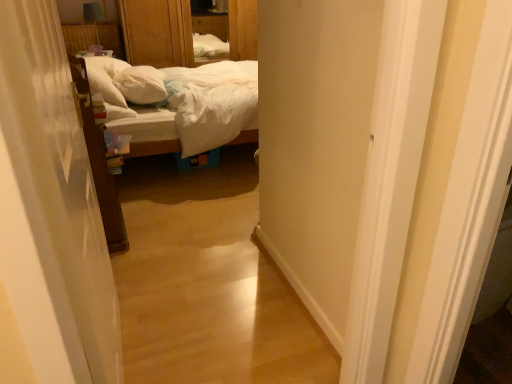
Question: Does wooden dresser at upper center lie behind white soft pillow at center?

Choices:
 (A) yes
 (B) no

Answer: (A)

Question: Is wooden dresser at upper center aimed at white soft pillow at center?

Choices:
 (A) yes
 (B) no

Answer: (A)

Question: Can you confirm if wooden dresser at upper center is bigger than white soft pillow at center?

Choices:
 (A) no
 (B) yes

Answer: (B)

Question: Does wooden dresser at upper center have a lesser height compared to white soft pillow at center?

Choices:
 (A) no
 (B) yes

Answer: (A)

Question: Considering the relative sizes of wooden dresser at upper center and white soft pillow at center in the image provided, is wooden dresser at upper center thinner than white soft pillow at center?

Choices:
 (A) no
 (B) yes

Answer: (A)

Question: Considering the relative sizes of wooden dresser at upper center and white soft pillow at center in the image provided, is wooden dresser at upper center taller than white soft pillow at center?

Choices:
 (A) no
 (B) yes

Answer: (B)

Question: Is white soft pillow at center located outside wooden dresser at upper center?

Choices:
 (A) yes
 (B) no

Answer: (A)

Question: From a real-world perspective, is white soft pillow at center below wooden dresser at upper center?

Choices:
 (A) yes
 (B) no

Answer: (A)

Question: Is white soft pillow at center oriented away from wooden dresser at upper center?

Choices:
 (A) no
 (B) yes

Answer: (A)

Question: Considering the relative sizes of white soft pillow at center and wooden dresser at upper center in the image provided, is white soft pillow at center smaller than wooden dresser at upper center?

Choices:
 (A) no
 (B) yes

Answer: (B)

Question: Is white soft pillow at center further to camera compared to wooden dresser at upper center?

Choices:
 (A) yes
 (B) no

Answer: (B)

Question: Is white soft pillow at center shorter than wooden dresser at upper center?

Choices:
 (A) yes
 (B) no

Answer: (A)

Question: Is white sheer curtain at left at the right side of wooden dresser at upper center?

Choices:
 (A) no
 (B) yes

Answer: (B)